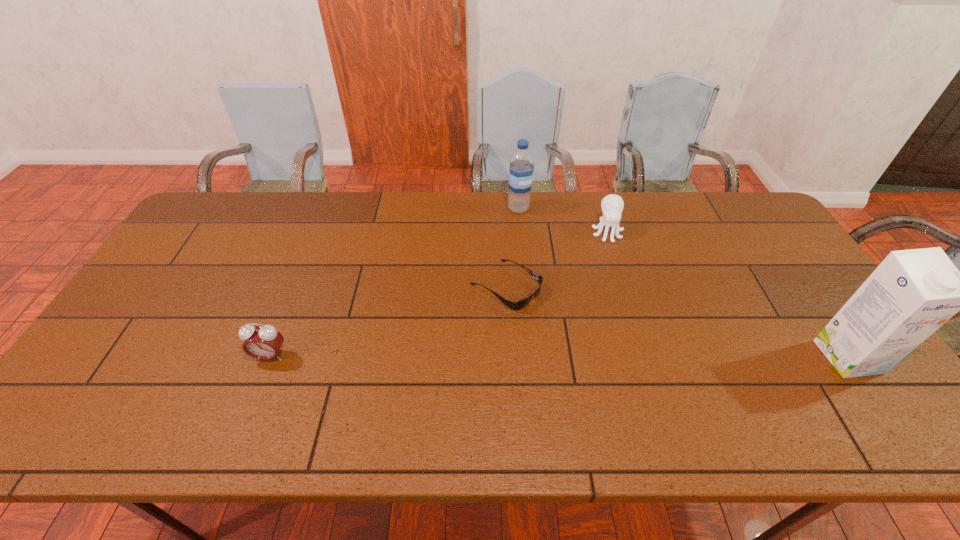
Locate an element on the screen. This screenshot has width=960, height=540. alarm clock is located at coordinates (261, 342).

The image size is (960, 540). Find the location of `the tallest object`. the tallest object is located at coordinates (912, 293).

Where is `the rightmost object`? The image size is (960, 540). the rightmost object is located at coordinates (912, 293).

Where is `water bottle`? water bottle is located at coordinates (521, 169).

Where is `the farthest object`? This screenshot has height=540, width=960. the farthest object is located at coordinates (521, 169).

You are a GUI agent. You are given a task and a screenshot of the screen. Output one action in this format:
    pyautogui.click(x=<x>, y=<y>)
    Task: Click on the second farthest object
    The image size is (960, 540).
    Given the screenshot: What is the action you would take?
    pyautogui.click(x=612, y=205)

Image resolution: width=960 pixels, height=540 pixels. What are the coordinates of `octopus` in the screenshot? It's located at coord(612,205).

The width and height of the screenshot is (960, 540). In order to click on the shortest object in this screenshot , I will do `click(518, 305)`.

Identify the location of sunglasses. (518, 305).

Where is `vacant space situated 0.090m on the clock face of the leftmost object`? vacant space situated 0.090m on the clock face of the leftmost object is located at coordinates click(254, 396).